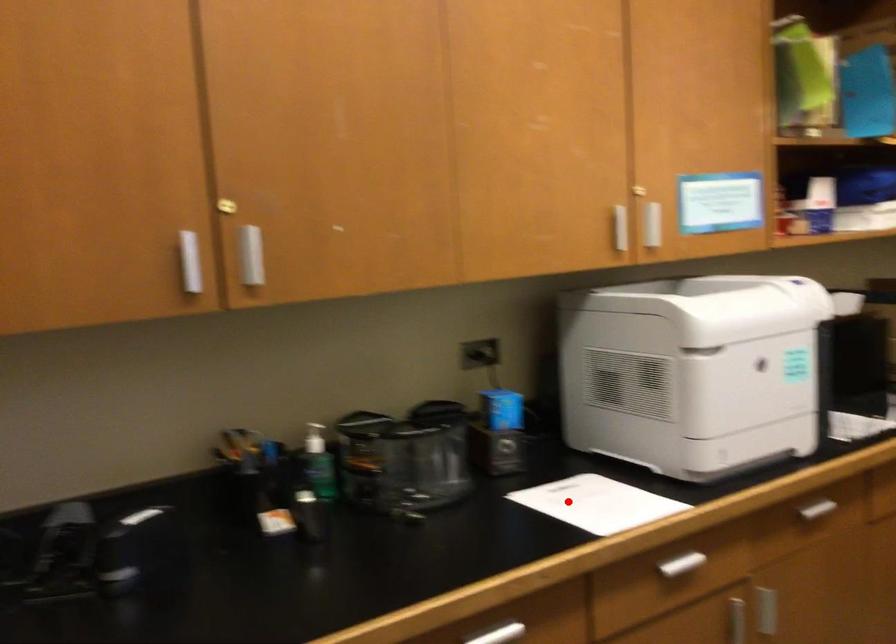
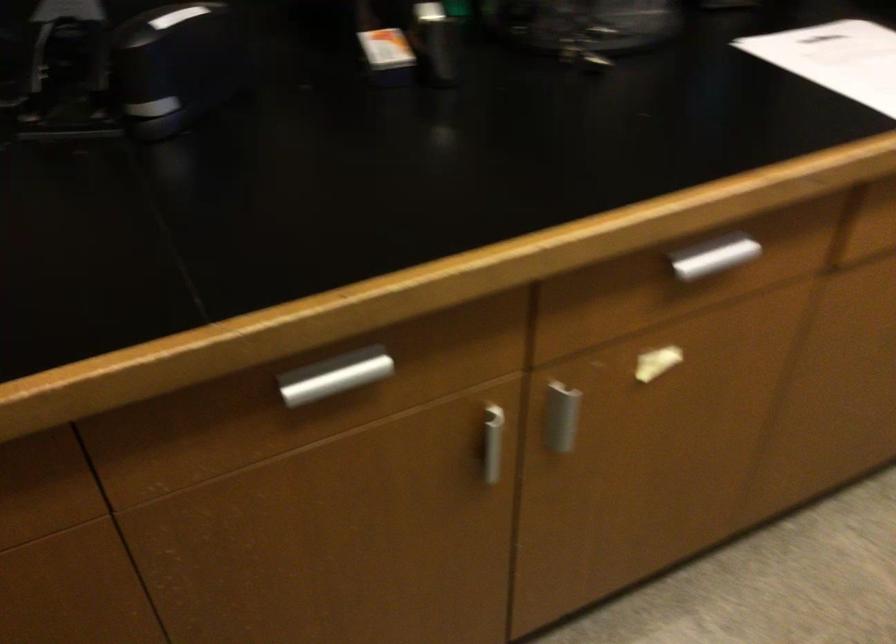
Question: I am providing you with two images of the same scene from different viewpoints. Image1 has a red point marked. In image2, the corresponding 3D location appears at what relative position? Reply with the corresponding letter.

Choices:
 (A) Closer
 (B) Farther

Answer: (A)